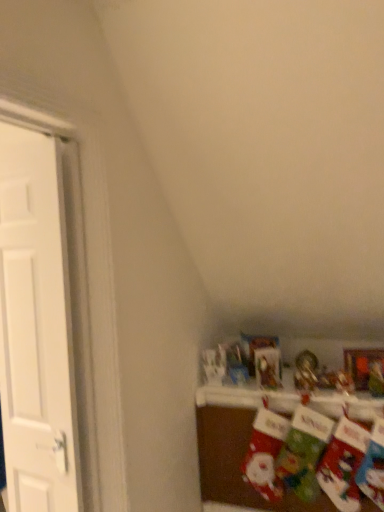
Question: Choose the correct answer: Is white matte door at left inside matte fabric stockings at lower right or outside it?

Choices:
 (A) inside
 (B) outside

Answer: (B)

Question: Is white matte door at left bigger or smaller than matte fabric stockings at lower right?

Choices:
 (A) big
 (B) small

Answer: (B)

Question: From the image's perspective, is white matte door at left positioned above or below matte fabric stockings at lower right?

Choices:
 (A) above
 (B) below

Answer: (A)

Question: In the image, is matte fabric stockings at lower right positioned in front of or behind white matte door at left?

Choices:
 (A) behind
 (B) front

Answer: (A)

Question: Is matte fabric stockings at lower right situated inside white matte door at left or outside?

Choices:
 (A) outside
 (B) inside

Answer: (A)

Question: Considering the positions of matte fabric stockings at lower right and white matte door at left in the image, is matte fabric stockings at lower right bigger or smaller than white matte door at left?

Choices:
 (A) small
 (B) big

Answer: (B)

Question: In terms of height, does matte fabric stockings at lower right look taller or shorter compared to white matte door at left?

Choices:
 (A) short
 (B) tall

Answer: (A)